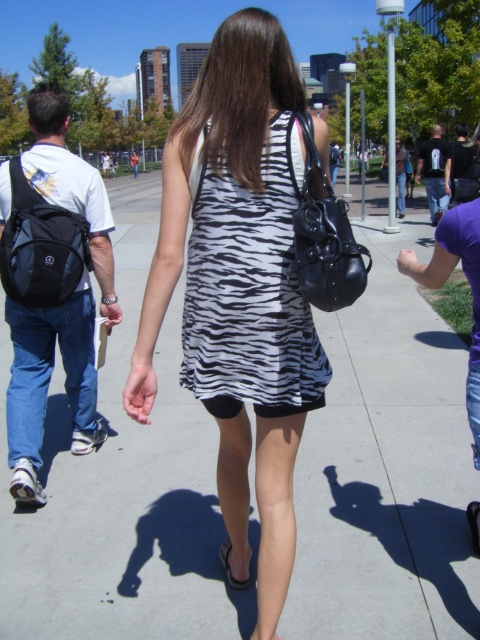
Question: Among these objects, which one is farthest from the camera?

Choices:
 (A) zebra-patterned fabric dress at center
 (B) zebra-patterned dress at center
 (C) matte concrete sidewalk at center
 (D) black fabric backpack at left

Answer: (D)

Question: Which of the following is the closest to the observer?

Choices:
 (A) zebra-patterned dress at center
 (B) black leather sandal at lower center

Answer: (A)

Question: Which object is closer to the camera taking this photo?

Choices:
 (A) black fabric backpack at left
 (B) zebra-patterned fabric dress at center
 (C) black rubber sandal at lower center

Answer: (B)

Question: Observing the image, what is the correct spatial positioning of black rubber sandal at lower center in reference to black leather sandal at lower center?

Choices:
 (A) above
 (B) below

Answer: (A)

Question: Can you confirm if black fabric backpack at left is positioned above black synthetic sandal at lower center?

Choices:
 (A) no
 (B) yes

Answer: (B)

Question: Observing the image, what is the correct spatial positioning of zebra-patterned dress at center in reference to black leather sandal at lower center?

Choices:
 (A) right
 (B) left

Answer: (B)